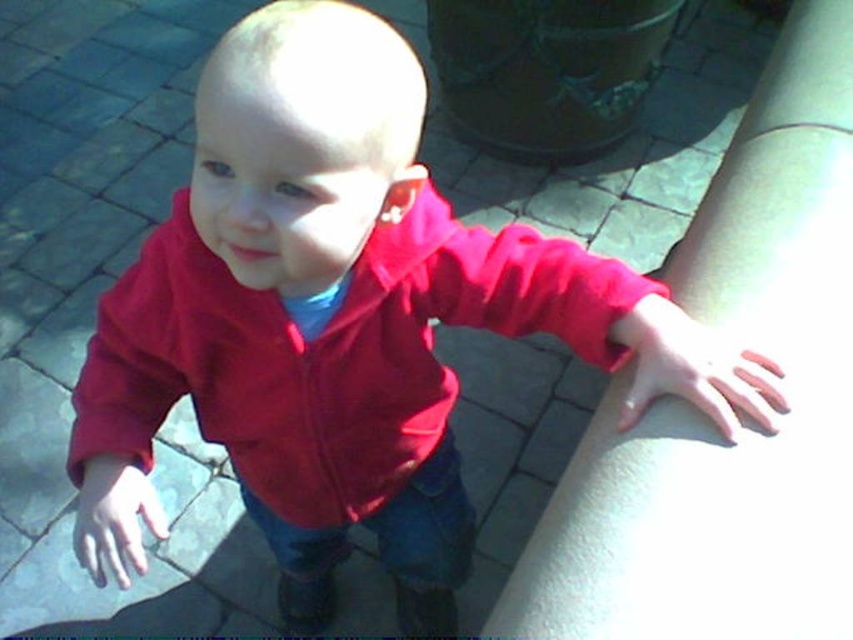
Question: Which point is closer to the camera taking this photo?

Choices:
 (A) (154, 308)
 (B) (608, 352)
 (C) (643, 337)

Answer: (C)

Question: Estimate the real-world distances between objects in this image. Which object is closer to the pink fabric at lower right?

Choices:
 (A) matte red sleeve at lower left
 (B) matte red hand at lower left

Answer: (A)

Question: Is matte red jacket at center wider than matte red hand at lower left?

Choices:
 (A) yes
 (B) no

Answer: (A)

Question: Does matte red jacket at center appear on the right side of matte red sleeve at lower left?

Choices:
 (A) yes
 (B) no

Answer: (A)

Question: Does smooth skin hand at lower right appear over matte red hand at lower left?

Choices:
 (A) yes
 (B) no

Answer: (A)

Question: Considering the real-world distances, which object is farthest from the matte red jacket at center?

Choices:
 (A) matte red sleeve at lower left
 (B) smooth skin hand at lower right
 (C) matte red hand at lower left
 (D) pink fabric at lower right

Answer: (B)